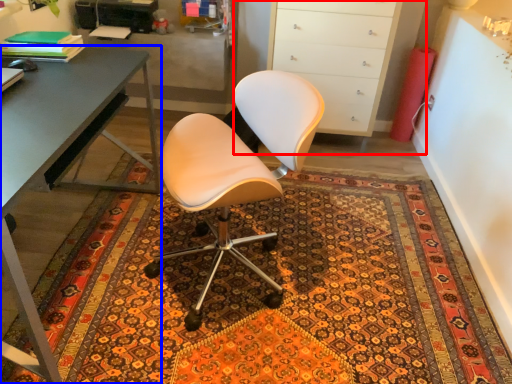
Question: Among these objects, which one is farthest to the camera, cabinetry (highlighted by a red box) or desk (highlighted by a blue box)?

Choices:
 (A) cabinetry
 (B) desk

Answer: (A)